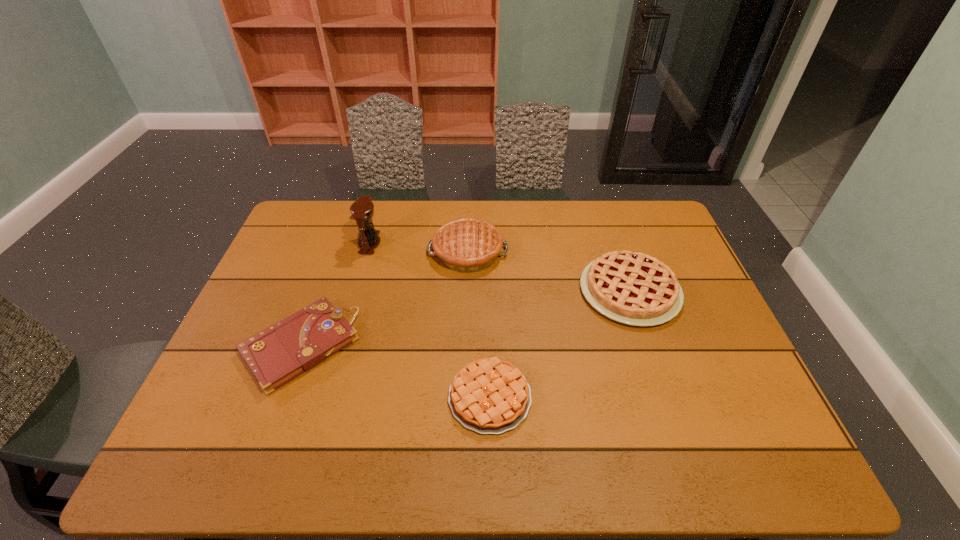
You are a GUI agent. You are given a task and a screenshot of the screen. Output one action in this format:
    pyautogui.click(x=<x>, y=<y>)
    Task: Click on the vacant space located 0.290m on the left of the nearest pie
    
    Given the screenshot: What is the action you would take?
    pyautogui.click(x=328, y=397)

Image resolution: width=960 pixels, height=540 pixels. In order to click on hourglass that is at the far edge in this screenshot , I will do `click(362, 210)`.

What are the coordinates of `pie that is positioned at the far edge` in the screenshot? It's located at (466, 245).

Find the location of a particular element. This screenshot has width=960, height=540. object that is at the near edge is located at coordinates (489, 396).

You are a GUI agent. You are given a task and a screenshot of the screen. Output one action in this format:
    pyautogui.click(x=<x>, y=<y>)
    Task: Click on the object that is positioned at the left edge
    This screenshot has height=540, width=960.
    Given the screenshot: What is the action you would take?
    click(x=276, y=355)

At what (x,y) coordinates should I click in order to perform the action: click on object located in the right edge section of the desktop. Please return your answer as a coordinate pair (x, y). Looking at the image, I should click on (632, 288).

At what (x,y) coordinates should I click in order to perform the action: click on vacant area at the far edge of the desktop. Please return your answer as a coordinate pair (x, y). The width and height of the screenshot is (960, 540). Looking at the image, I should click on (555, 215).

Where is `vacant area at the near edge`? The height and width of the screenshot is (540, 960). vacant area at the near edge is located at coordinates (464, 470).

Identify the location of free region at the left edge of the desktop. (235, 334).

The height and width of the screenshot is (540, 960). I want to click on vacant region at the right edge, so click(x=672, y=265).